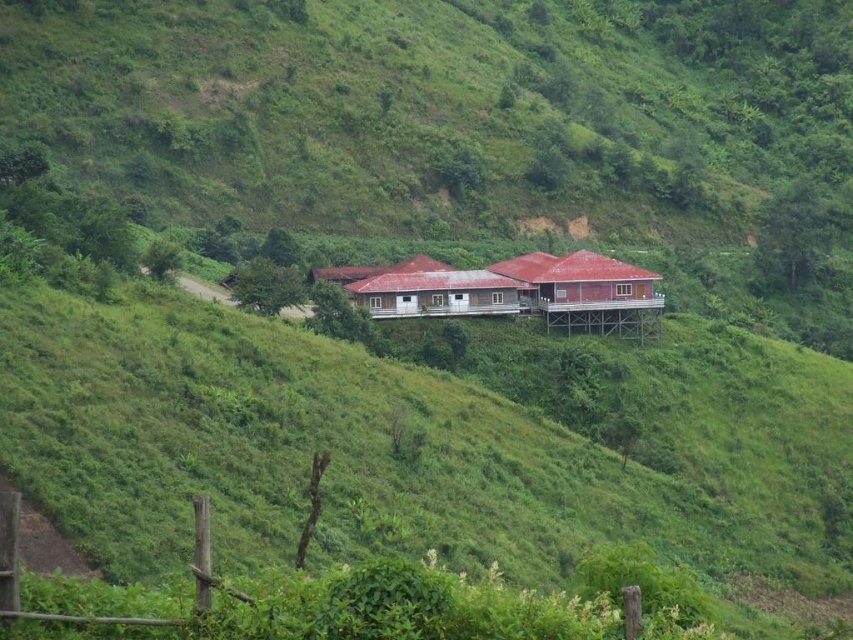
Can you confirm if wooden hut at center is positioned to the left of brown wooden house at center?

In fact, wooden hut at center is to the right of brown wooden house at center.

Does wooden hut at center have a greater height compared to brown wooden house at center?

Correct, wooden hut at center is much taller as brown wooden house at center.

Does point (339, 284) come farther from viewer compared to point (428, 272)?

Yes, it is behind point (428, 272).

Locate an element on the screen. This screenshot has height=640, width=853. wooden hut at center is located at coordinates pyautogui.click(x=511, y=291).